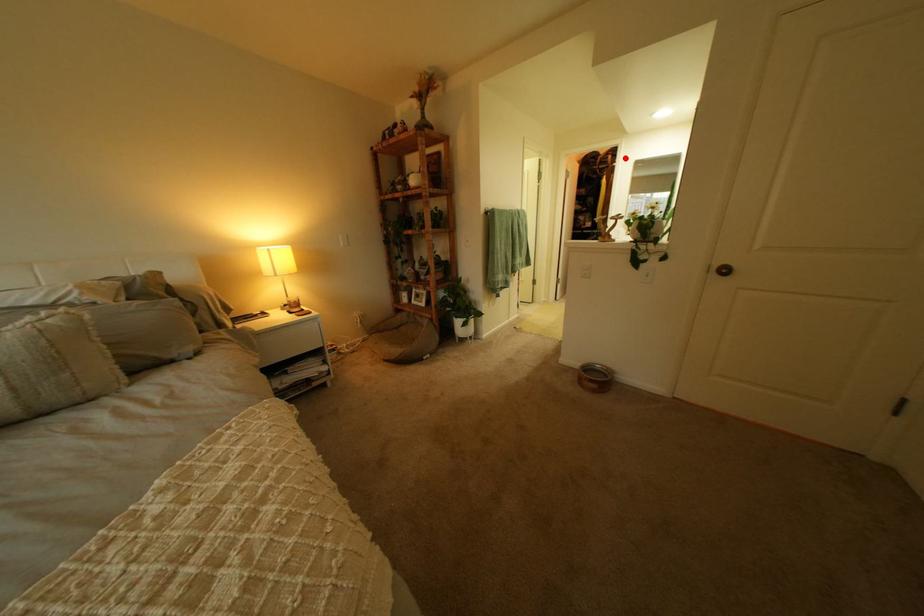
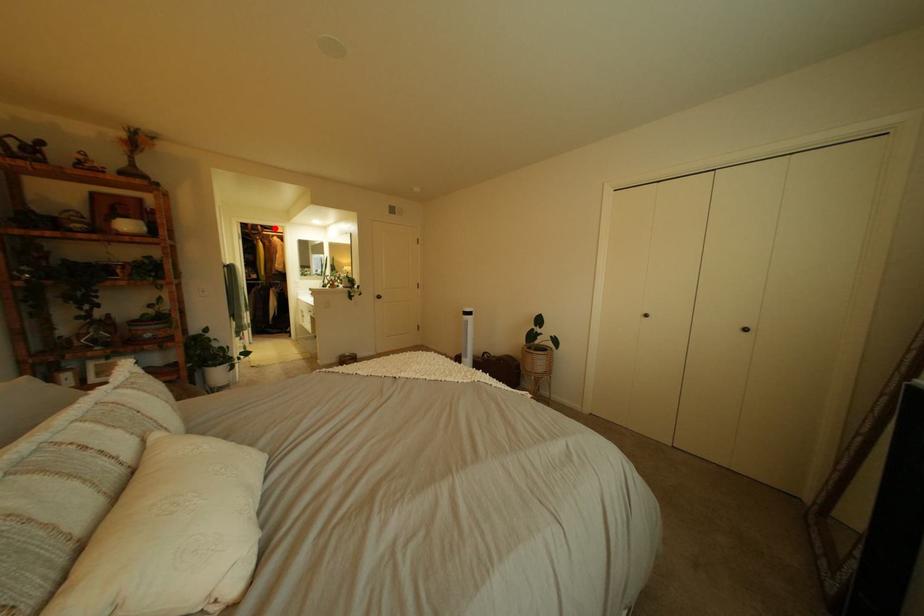
I am providing you with two images of the same scene from different viewpoints. A red point is marked on the first image and another point is marked on the second image. Do the highlighted points in image1 and image2 indicate the same real-world spot?

Yes